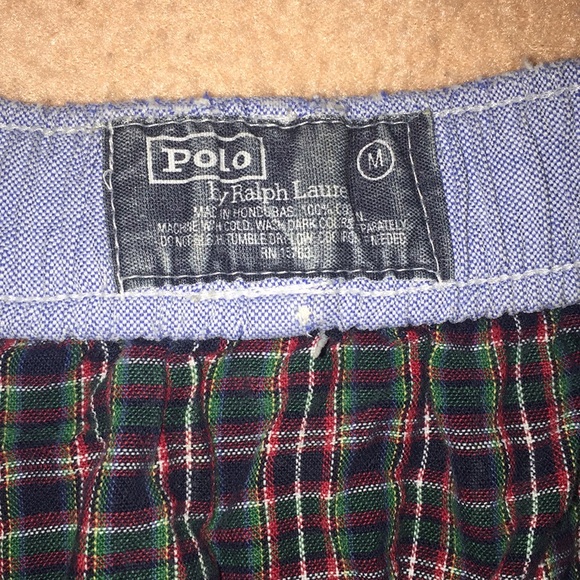
Locate an element on the screen. The image size is (580, 580). surface is located at coordinates (242, 64).